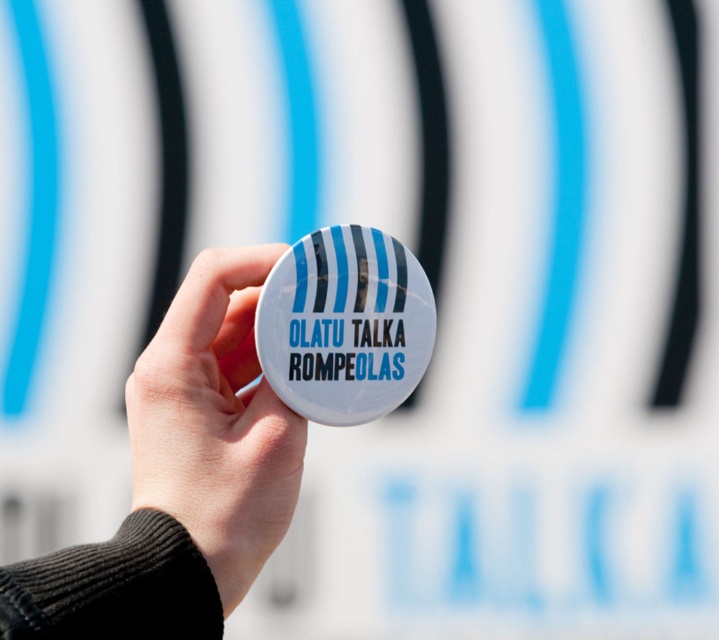
You are designing a display for a product showcase and need to arrange two buttons on a vertical stand. The stand has limited space. You have the white matte button at center and the white glossy button at center. According to the image, which button should be placed higher on the stand to match the original arrangement?

The white glossy button at center should be placed higher on the stand because in the original arrangement, the white matte button at center is below the white glossy button at center.

Based on the photo, you are designing a uniform for a company and need to choose between the white matte button at center and the white glossy button at center for the collar. The design requires the button to be taller. Which button should you select?

The white matte button at center has a greater height compared to the white glossy button at center, so you should select the white matte button at center for the collar as it meets the height requirement.

You are a designer reviewing a prototype and notice two buttons on the device. The white matte button at center and the white glossy button at center. Which button is closer to you?

The white matte button at center is in front of the white glossy button at center, so it is closer to you.